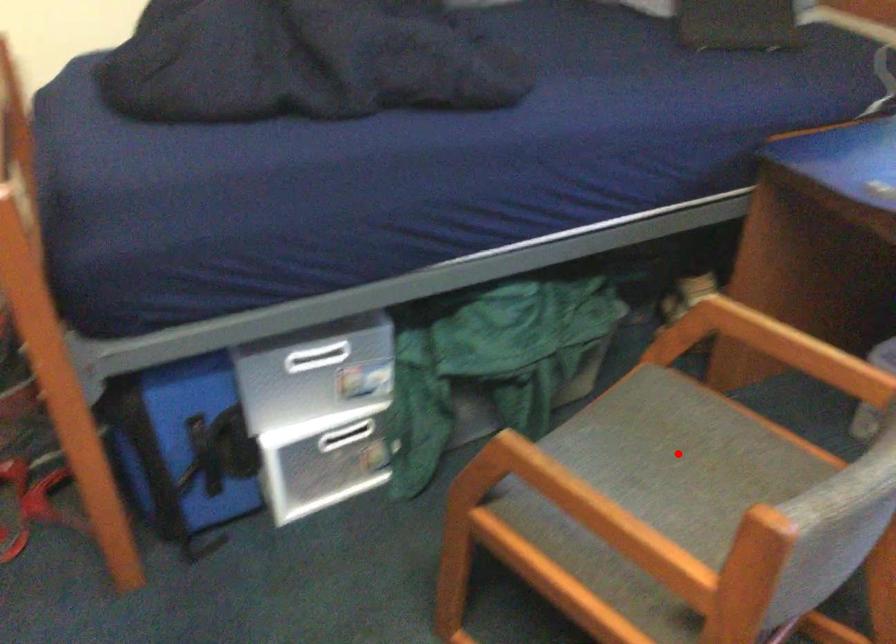
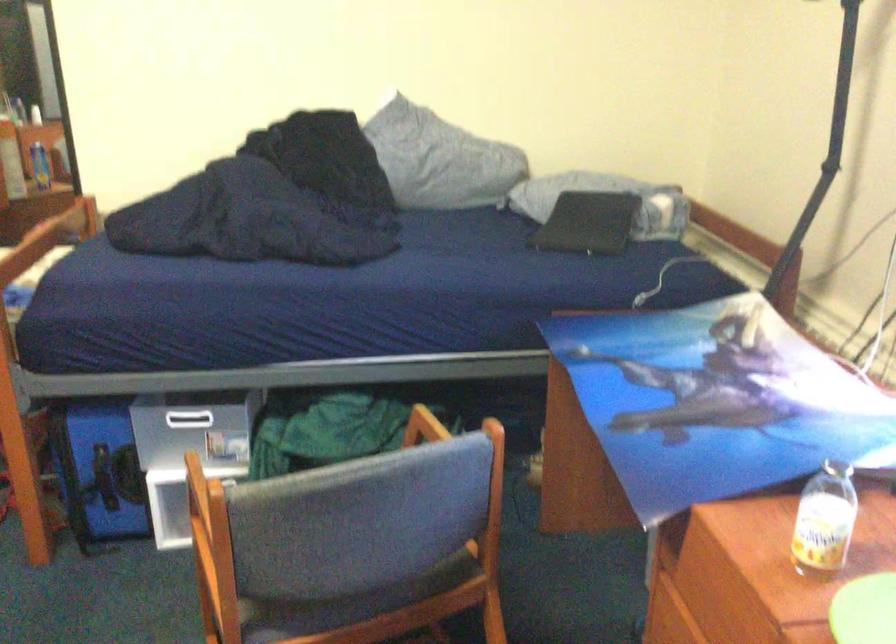
Question: I am providing you with two images of the same scene from different viewpoints. A red point is marked on the first image. Can you still see the location of the red point in image 2?

Choices:
 (A) Yes
 (B) No

Answer: (B)